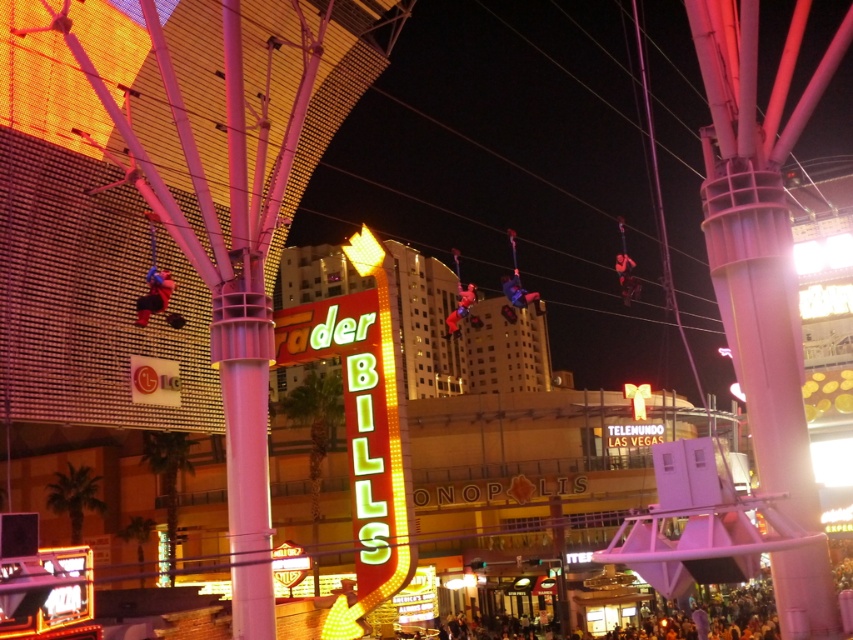
Question: Is matte black crowd at lower center to the left of red fabric superhero at center from the viewer's perspective?

Choices:
 (A) yes
 (B) no

Answer: (B)

Question: Which point is farther from the camera taking this photo?

Choices:
 (A) (637, 600)
 (B) (155, 308)

Answer: (A)

Question: Is matte black crowd at lower center below red fabric superhero at center?

Choices:
 (A) yes
 (B) no

Answer: (A)

Question: Does black fabric person at center appear under metallic blue suit at center?

Choices:
 (A) no
 (B) yes

Answer: (A)

Question: Which point appears closest to the camera in this image?

Choices:
 (A) (509, 282)
 (B) (595, 576)
 (C) (152, 310)
 (D) (454, 330)

Answer: (C)

Question: Which object is farther from the camera taking this photo?

Choices:
 (A) black fabric person at center
 (B) matte blue suit at left
 (C) matte black crowd at lower center

Answer: (A)